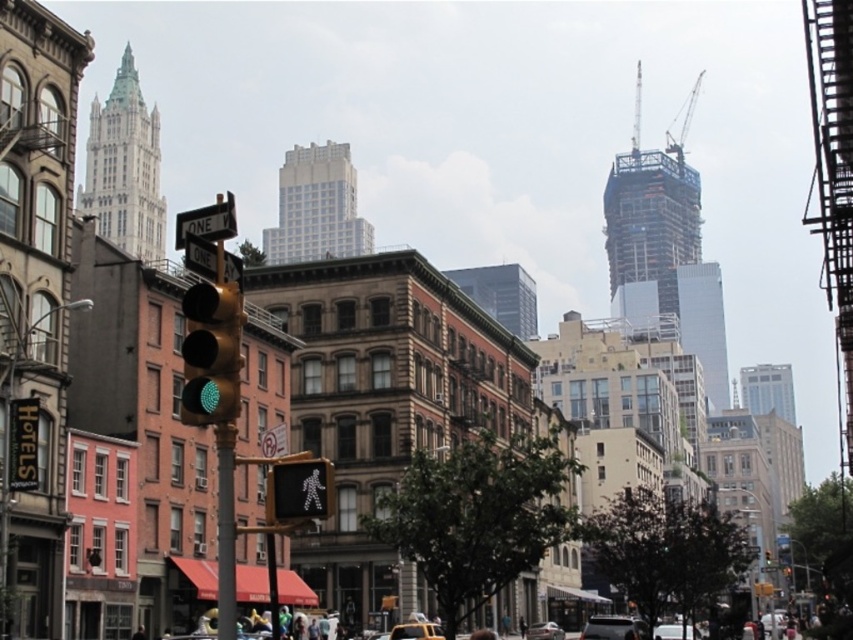
In the scene shown: Who is positioned more to the right, green glass traffic light at center or yellow rubber taxi cab at center?

From the viewer's perspective, yellow rubber taxi cab at center appears more on the right side.

Can you confirm if green glass traffic light at center is positioned to the left of yellow rubber taxi cab at center?

Indeed, green glass traffic light at center is positioned on the left side of yellow rubber taxi cab at center.

The width and height of the screenshot is (853, 640). In order to click on green glass traffic light at center in this screenshot , I will do `click(212, 353)`.

Does metallic silver car at center come in front of silver metallic sedan at lower center?

Yes, it is.

Describe the element at coordinates (611, 627) in the screenshot. The width and height of the screenshot is (853, 640). I see `metallic silver car at center` at that location.

What are the coordinates of `metallic silver car at center` in the screenshot? It's located at (611, 627).

Which is more to the right, translucent plastic pedestrian signal at center or metallic pole at center?

translucent plastic pedestrian signal at center

Can you confirm if translucent plastic pedestrian signal at center is smaller than metallic pole at center?

Correct, translucent plastic pedestrian signal at center occupies less space than metallic pole at center.

What do you see at coordinates (299, 490) in the screenshot?
I see `translucent plastic pedestrian signal at center` at bounding box center [299, 490].

Locate an element on the screen. translucent plastic pedestrian signal at center is located at coordinates coord(299,490).